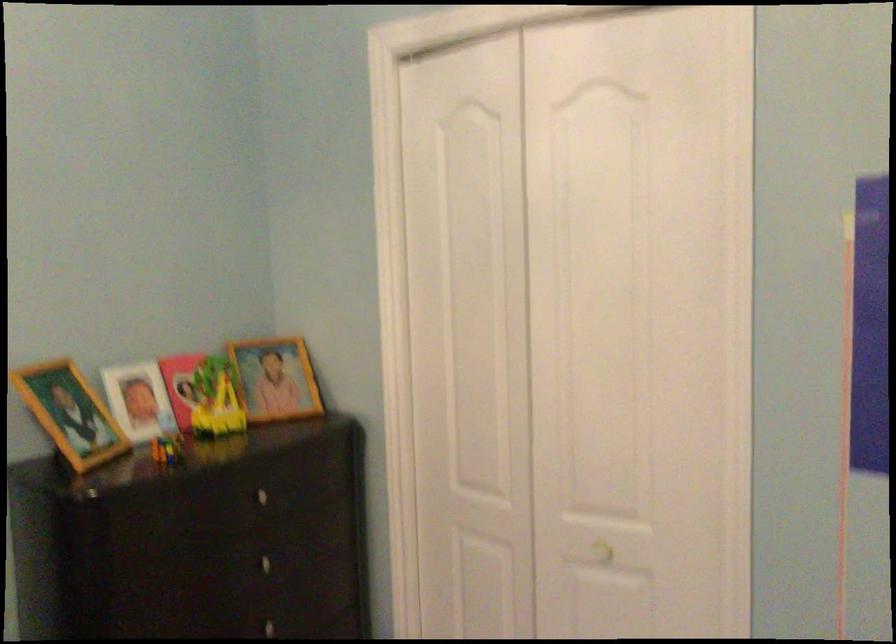
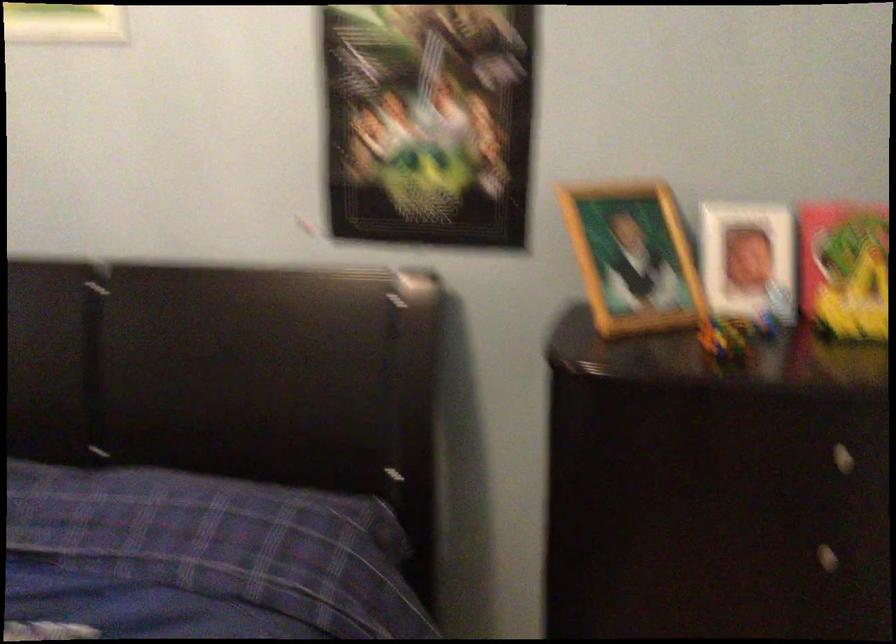
Locate, in the second image, the point that corresponds to point (263, 500) in the first image.

(840, 458)